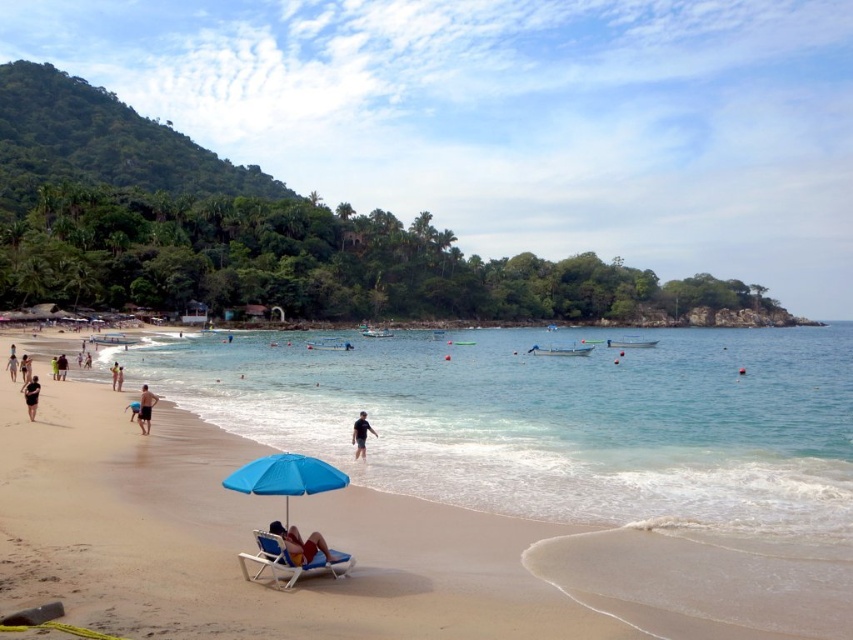
Question: Does blue fabric umbrella at lower center appear under black matte person at center?

Choices:
 (A) yes
 (B) no

Answer: (B)

Question: Does white plastic beach chair at center have a lesser width compared to matte blue umbrella at center?

Choices:
 (A) yes
 (B) no

Answer: (B)

Question: Which object is closer to the camera taking this photo?

Choices:
 (A) black fabric shorts at lower left
 (B) black matte person at center

Answer: (B)

Question: Does matte blue umbrella at center have a smaller size compared to tan skin person at lower left?

Choices:
 (A) no
 (B) yes

Answer: (B)

Question: Among these objects, which one is nearest to the camera?

Choices:
 (A) tan skin person at lower left
 (B) black matte person at center

Answer: (B)

Question: Which point is farther to the camera?

Choices:
 (A) (28, 404)
 (B) (292, 560)
 (C) (140, 394)
 (D) (245, 472)

Answer: (C)